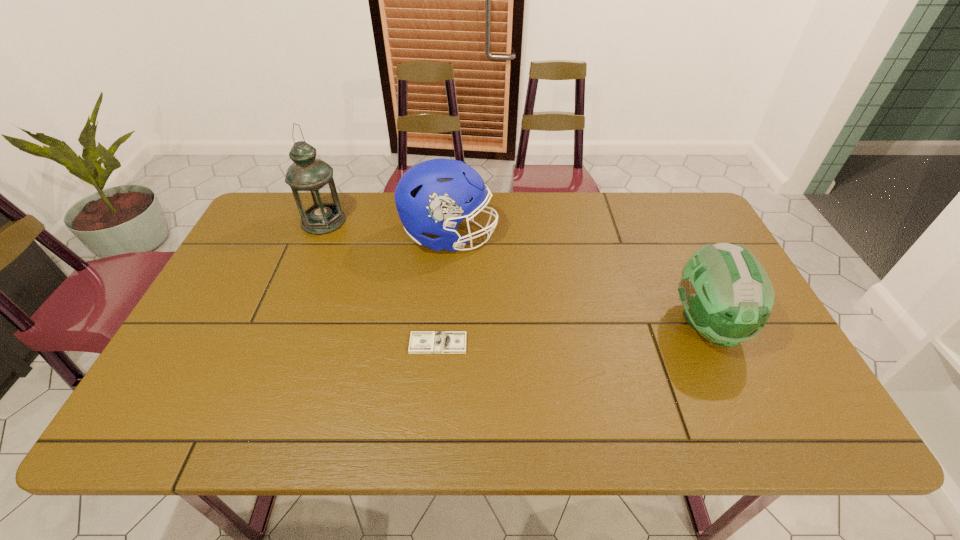
I want to click on the leftmost object, so click(311, 180).

Identify the location of oil lamp. This screenshot has height=540, width=960. (311, 180).

Where is `the left football helmet`? This screenshot has height=540, width=960. the left football helmet is located at coordinates (433, 196).

The height and width of the screenshot is (540, 960). I want to click on the shorter football helmet, so click(727, 296).

Where is `the right football helmet`? Image resolution: width=960 pixels, height=540 pixels. the right football helmet is located at coordinates (727, 296).

This screenshot has width=960, height=540. I want to click on dollar, so pyautogui.click(x=421, y=342).

The image size is (960, 540). I want to click on vacant space situated 0.250m on the front of the tallest object, so click(x=294, y=294).

The width and height of the screenshot is (960, 540). Find the location of `vacant area situated on the face guard of the farther football helmet`. vacant area situated on the face guard of the farther football helmet is located at coordinates (533, 237).

Locate an element on the screen. This screenshot has width=960, height=540. free spot located 0.090m on the visor of the shorter football helmet is located at coordinates (739, 396).

What are the coordinates of `vacant region located on the back of the dollar` in the screenshot? It's located at (446, 240).